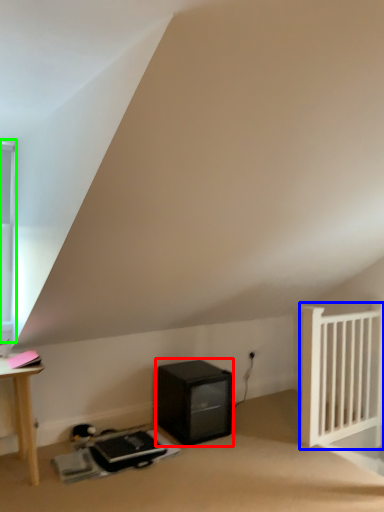
Question: Which object is the closest to the appliance (highlighted by a red box)? Choose among these: radiator (highlighted by a blue box) or window (highlighted by a green box).

Choices:
 (A) radiator
 (B) window

Answer: (A)